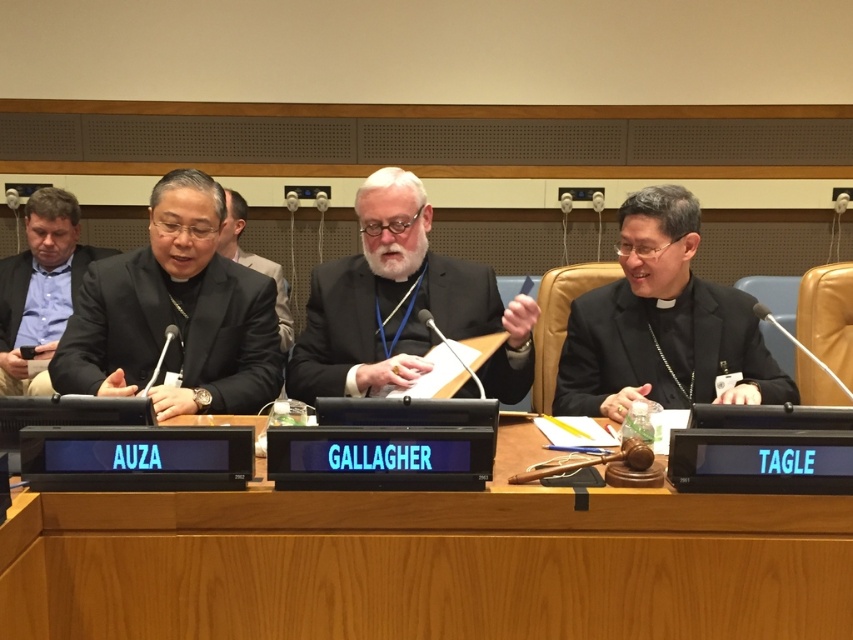
Question: Can you confirm if wooden table at center is thinner than black matte robe at right?

Choices:
 (A) yes
 (B) no

Answer: (B)

Question: Based on their relative distances, which object is nearer to the black matte robe at right?

Choices:
 (A) wooden table at center
 (B) black woolen robe at center
 (C) black satin robe at left

Answer: (B)

Question: Does black satin robe at left appear on the left side of black woolen robe at center?

Choices:
 (A) no
 (B) yes

Answer: (B)

Question: Does black satin robe at left appear on the right side of black matte robe at right?

Choices:
 (A) no
 (B) yes

Answer: (A)

Question: Which point is farther from the camera taking this photo?

Choices:
 (A) (807, 528)
 (B) (412, 278)
 (C) (701, 376)

Answer: (B)

Question: Which object appears farthest from the camera in this image?

Choices:
 (A) black woolen robe at center
 (B) black matte robe at right

Answer: (A)